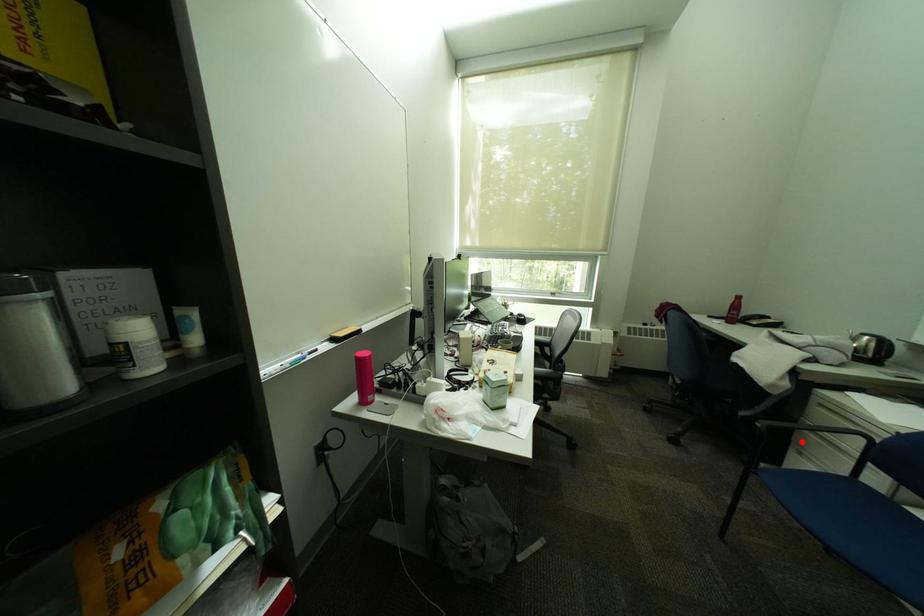
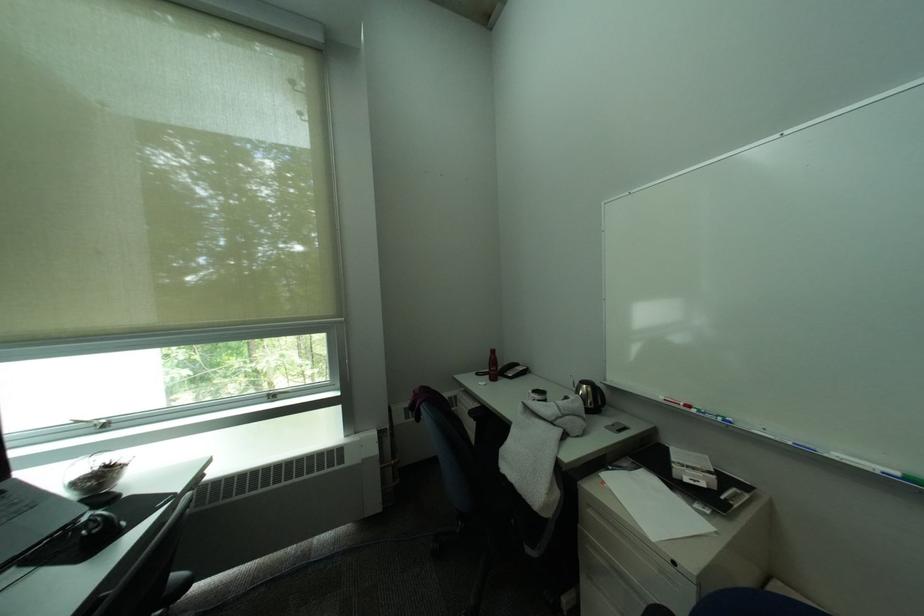
Find the pixel in the second image that matches the highlighted location in the first image.

(590, 561)